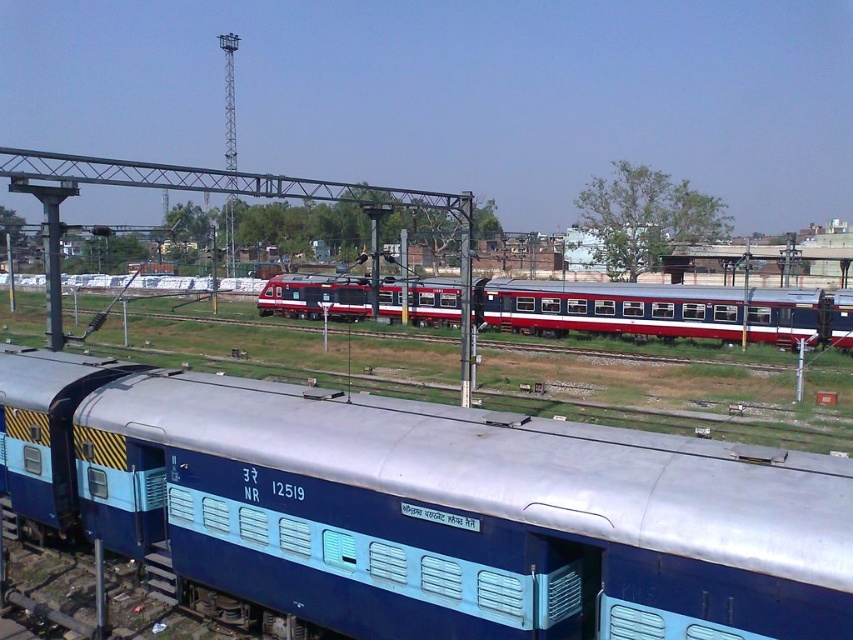
You are standing at the railway station and see two points marked on the image. Which point, point (x=68, y=420) or point (x=695, y=308), is closer to you?

Point (x=68, y=420) is closer to you than point (x=695, y=308).

You are a photographer standing at the railway station. You want to take a photo of the blue metallic train car at lower left and the red glossy passenger train at center. Which train car is positioned closer to you?

The blue metallic train car at lower left is closer to the viewer than the red glossy passenger train at center.

You are standing at the center of the image. Which direction should you look to see the blue metallic train car at lower left?

You should look to the lower left direction to see the blue metallic train car at lower left.